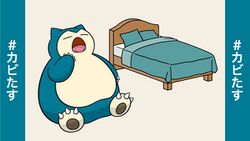
The height and width of the screenshot is (141, 250). I want to click on white bed sheet, so click(x=117, y=47).